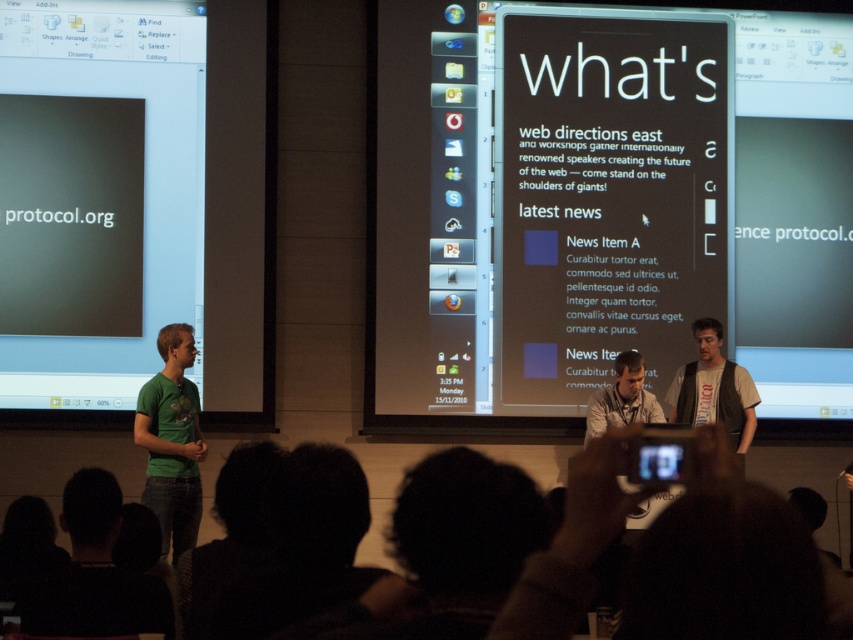
Question: Based on their relative distances, which object is farther from the white t-shirt at center?

Choices:
 (A) matte white shirt at center
 (B) black glossy screen at center

Answer: (B)

Question: Is black fabric at lower left in front of white t-shirt at center?

Choices:
 (A) no
 (B) yes

Answer: (B)

Question: Which of the following is the farthest from the observer?

Choices:
 (A) (839, 168)
 (B) (163, 620)
 (C) (643, 397)
 (D) (741, 410)

Answer: (A)

Question: Which point is farther to the camera?

Choices:
 (A) (175, 556)
 (B) (642, 403)
 (C) (601, 324)
 (D) (90, 525)

Answer: (C)

Question: From the image, what is the correct spatial relationship of black glossy screen at center in relation to matte white shirt at center?

Choices:
 (A) below
 (B) above

Answer: (B)

Question: Can you confirm if white t-shirt at center is wider than matte white shirt at center?

Choices:
 (A) no
 (B) yes

Answer: (B)